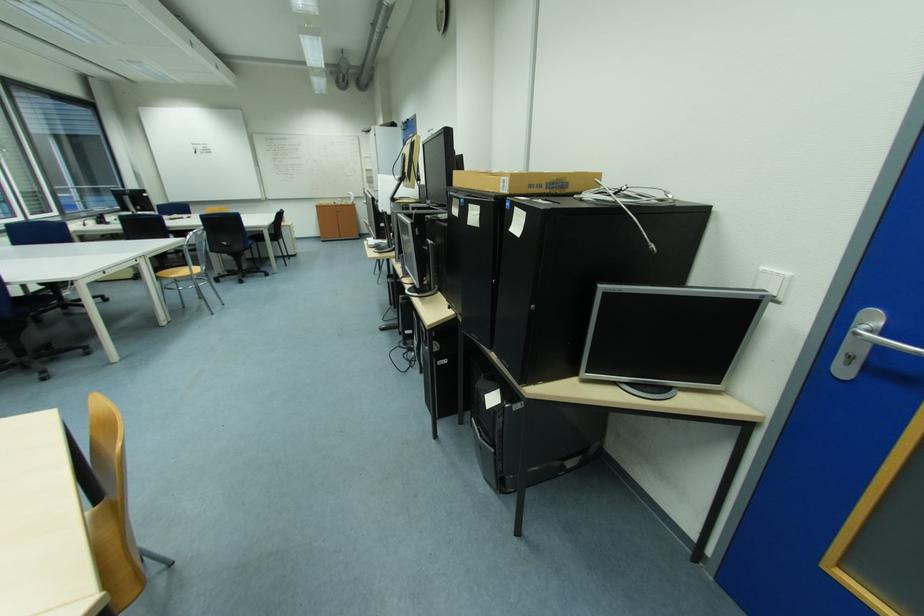
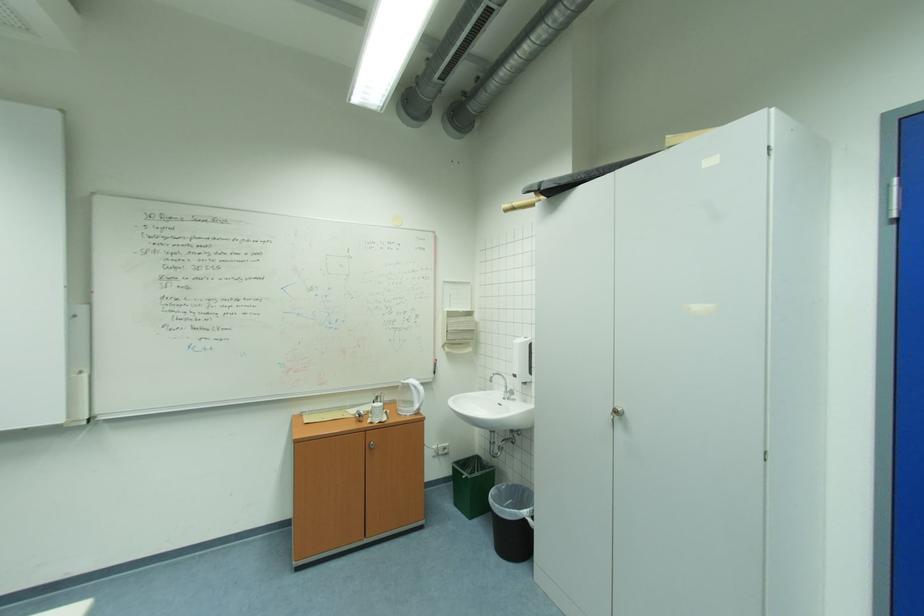
The point at [358,204] is marked in the first image. Where is the corresponding point in the second image?

(415, 411)